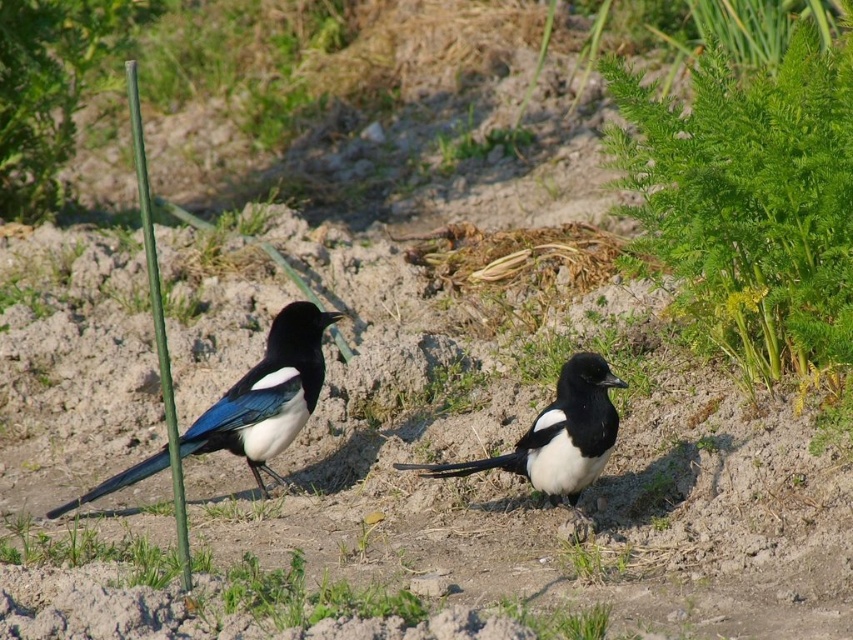
Where is `shiny black and white magpie at left`? Image resolution: width=853 pixels, height=640 pixels. shiny black and white magpie at left is located at coordinates (268, 394).

Does shiny black and white magpie at left have a larger size compared to white glossy magpie at center?

Indeed, shiny black and white magpie at left has a larger size compared to white glossy magpie at center.

Is point (289, 337) farther from viewer compared to point (550, 480)?

Yes, point (289, 337) is behind point (550, 480).

Where is `shiny black and white magpie at left`? shiny black and white magpie at left is located at coordinates (268, 394).

Can you confirm if green leafy grass at upper right is smaller than white glossy magpie at center?

No.

Between green leafy grass at upper right and white glossy magpie at center, which one has less height?

white glossy magpie at center

Is point (718, 253) positioned before point (572, 397)?

No, (718, 253) is behind (572, 397).

Identify the location of green leafy grass at upper right. The image size is (853, 640). (752, 208).

Can you confirm if green leafy grass at upper right is positioned to the right of shiny black and white magpie at left?

Correct, you'll find green leafy grass at upper right to the right of shiny black and white magpie at left.

Between green leafy grass at upper right and shiny black and white magpie at left, which one has less height?

shiny black and white magpie at left is shorter.

What do you see at coordinates (752, 208) in the screenshot?
I see `green leafy grass at upper right` at bounding box center [752, 208].

This screenshot has width=853, height=640. Find the location of `green leafy grass at upper right`. green leafy grass at upper right is located at coordinates (752, 208).